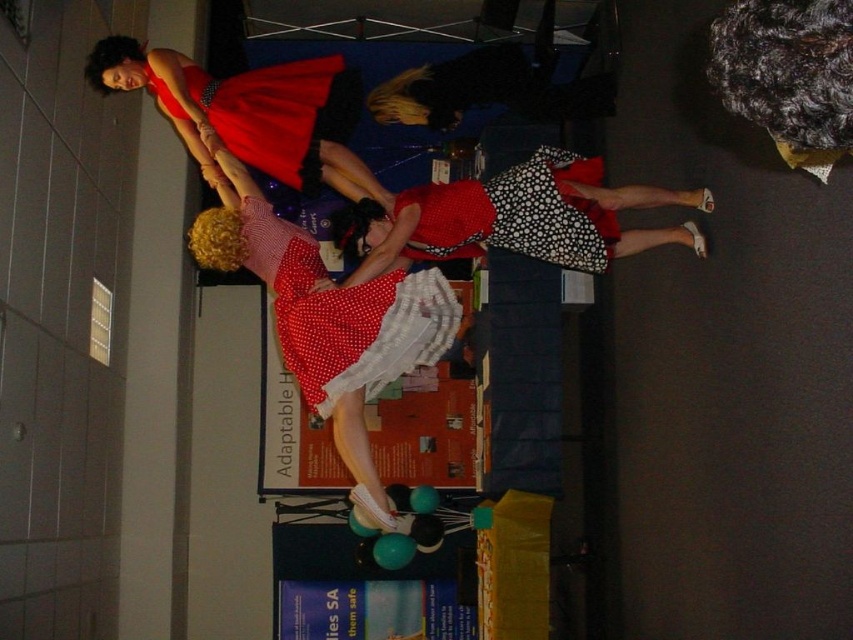
Where is `red polka dot fabric dress at center`? Image resolution: width=853 pixels, height=640 pixels. red polka dot fabric dress at center is located at coordinates (345, 316).

Who is more distant from viewer, [370,340] or [274,77]?

Point [274,77]

What are the coordinates of `red polka dot fabric dress at center` in the screenshot? It's located at (345, 316).

Does polka dot fabric dress at center have a smaller size compared to matte red dress at upper left?

No.

This screenshot has width=853, height=640. What do you see at coordinates (328, 317) in the screenshot?
I see `polka dot fabric dress at center` at bounding box center [328, 317].

Does point (393, 326) lie in front of point (306, 106)?

Yes, it is in front of point (306, 106).

This screenshot has height=640, width=853. I want to click on polka dot fabric dress at center, so click(328, 317).

Who is more distant from viewer, [312,248] or [461,218]?

Point [461,218]

Between point (395, 285) and point (523, 218), which one is positioned in front?

Point (395, 285) is more forward.

The width and height of the screenshot is (853, 640). What are the coordinates of `polka dot fabric dress at center` in the screenshot? It's located at (328, 317).